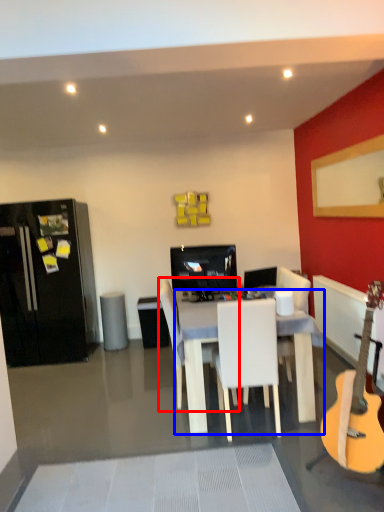
Question: Among these objects, which one is farthest to the camera, chair (highlighted by a red box) or desk (highlighted by a blue box)?

Choices:
 (A) chair
 (B) desk

Answer: (A)